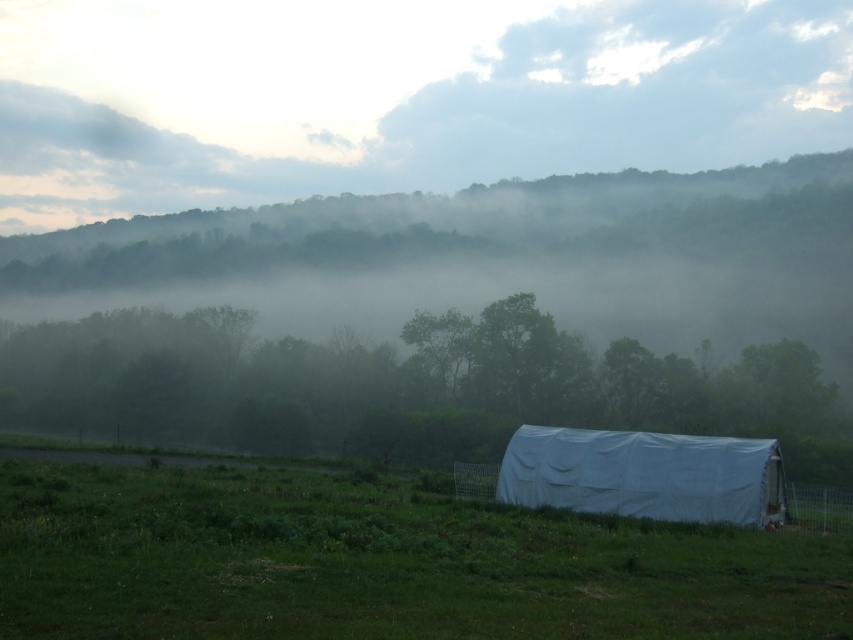
Is green grassy field at lower center shorter than white fabric tent at lower center?

No.

Which is in front, point (471, 605) or point (730, 512)?

Positioned in front is point (471, 605).

Which is in front, point (436, 604) or point (650, 454)?

Point (436, 604)

Locate an element on the screen. The image size is (853, 640). green grassy field at lower center is located at coordinates (380, 563).